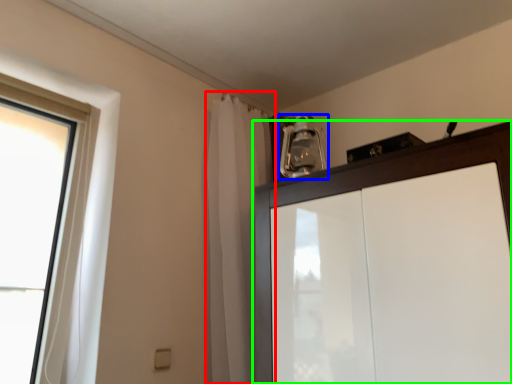
Question: Considering the real-world distances, which object is farthest from shower curtain (highlighted by a red box)? light fixture (highlighted by a blue box) or cupboard (highlighted by a green box)?

Choices:
 (A) light fixture
 (B) cupboard

Answer: (B)